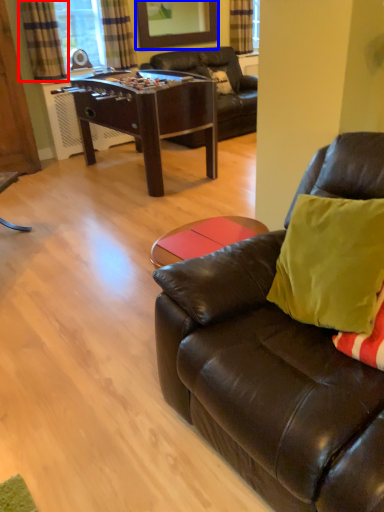
Question: Among these objects, which one is nearest to the camera, curtain (highlighted by a red box) or mirror (highlighted by a blue box)?

Choices:
 (A) curtain
 (B) mirror

Answer: (A)